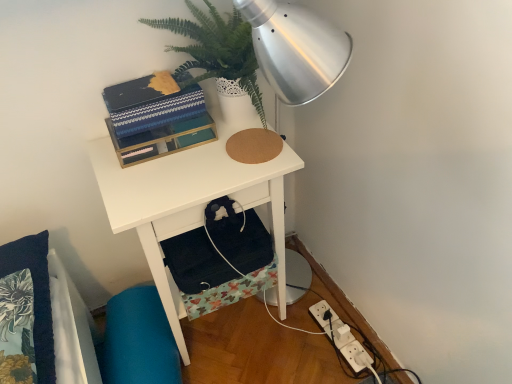
You are a GUI agent. You are given a task and a screenshot of the screen. Output one action in this format:
    pyautogui.click(x=<x>, y=<y>)
    Task: Click on the white matte desk at center
    
    Given the screenshot: What is the action you would take?
    pyautogui.click(x=189, y=201)

What do you see at coordinates (189, 201) in the screenshot? I see `white matte desk at center` at bounding box center [189, 201].

This screenshot has height=384, width=512. What do you see at coordinates (342, 337) in the screenshot?
I see `white plastic power outlet at lower right` at bounding box center [342, 337].

This screenshot has width=512, height=384. Find the location of `white plastic power outlet at lower right`. white plastic power outlet at lower right is located at coordinates (342, 337).

You are a GUI agent. You are given a task and a screenshot of the screen. Output one action in this format:
    pyautogui.click(x=<x>, y=<y>)
    Task: Click on the matte black book at upper center
    
    Given the screenshot: What is the action you would take?
    pyautogui.click(x=150, y=104)

In order to face green leafy plant at upper center, should I rotate leftwards or rightwards?

Turn left approximately 3.820 degrees to face it.

Locate an element on the screen. white matte desk at center is located at coordinates (189, 201).

From a real-world perspective, is matte black book at upper center physically located above or below teal fabric swivel chair at lower left?

From a real-world perspective, matte black book at upper center is physically above teal fabric swivel chair at lower left.

Considering the relative sizes of matte black book at upper center and teal fabric swivel chair at lower left in the image provided, is matte black book at upper center wider than teal fabric swivel chair at lower left?

No.

Considering the sizes of objects matte black book at upper center and teal fabric swivel chair at lower left in the image provided, who is bigger, matte black book at upper center or teal fabric swivel chair at lower left?

With larger size is teal fabric swivel chair at lower left.

Is matte black book at upper center shorter than teal fabric swivel chair at lower left?

Correct, matte black book at upper center is not as tall as teal fabric swivel chair at lower left.

Identify the location of paperback book above the white matte desk at center (from a real-world perspective). The image size is (512, 384). (150, 104).

Which point is more forward, (137, 189) or (143, 96)?

The point (137, 189) is in front.

From the image's perspective, which one is positioned lower, white matte desk at center or matte black book at upper center?

white matte desk at center, from the image's perspective.

Considering the positions of objects white matte desk at center and matte black book at upper center in the image provided, who is more to the right, white matte desk at center or matte black book at upper center?

From the viewer's perspective, white matte desk at center appears more on the right side.

Is point (277, 161) closer or farther from the camera than point (185, 47)?

Point (277, 161) is positioned closer to the camera compared to point (185, 47).

In terms of size, does white matte desk at center appear bigger or smaller than green leafy plant at upper center?

white matte desk at center is bigger than green leafy plant at upper center.

Is white matte desk at center thinner than green leafy plant at upper center?

In fact, white matte desk at center might be wider than green leafy plant at upper center.

Consider the image. Which object is closer to the camera, white matte desk at center or green leafy plant at upper center?

green leafy plant at upper center is more forward.

Can you tell me how much matte black book at upper center and white plastic power outlet at lower right differ in facing direction?

matte black book at upper center and white plastic power outlet at lower right are facing 5.46 degrees away from each other.

How far apart are matte black book at upper center and white plastic power outlet at lower right?

The distance of matte black book at upper center from white plastic power outlet at lower right is 35.13 inches.

Is matte black book at upper center facing towards white plastic power outlet at lower right?

No, matte black book at upper center does not turn towards white plastic power outlet at lower right.

Which is correct: matte black book at upper center is inside white plastic power outlet at lower right, or outside of it?

matte black book at upper center exists outside the volume of white plastic power outlet at lower right.

Considering the relative sizes of white plastic power outlet at lower right and teal fabric swivel chair at lower left in the image provided, is white plastic power outlet at lower right shorter than teal fabric swivel chair at lower left?

Yes.

From a real-world perspective, is white plastic power outlet at lower right beneath teal fabric swivel chair at lower left?

Correct, in the physical world, white plastic power outlet at lower right is lower than teal fabric swivel chair at lower left.

From a real-world perspective, who is located lower, teal fabric swivel chair at lower left or white plastic power outlet at lower right?

white plastic power outlet at lower right.

How different are the orientations of teal fabric swivel chair at lower left and white plastic power outlet at lower right in degrees?

There is a 78-degree angle between the facing directions of teal fabric swivel chair at lower left and white plastic power outlet at lower right.

From their relative heights in the image, would you say teal fabric swivel chair at lower left is taller or shorter than white plastic power outlet at lower right?

teal fabric swivel chair at lower left is taller than white plastic power outlet at lower right.

Considering the positions of objects white matte desk at center and white plastic power outlet at lower right in the image provided, who is more to the right, white matte desk at center or white plastic power outlet at lower right?

Positioned to the right is white plastic power outlet at lower right.

Is white matte desk at center bigger or smaller than white plastic power outlet at lower right?

Clearly, white matte desk at center is larger in size than white plastic power outlet at lower right.

From a real-world perspective, is white matte desk at center under white plastic power outlet at lower right?

No, from a real-world perspective, white matte desk at center is not beneath white plastic power outlet at lower right.

Where is `power outlet that appears below the white matte desk at center (from the image's perspective)`? power outlet that appears below the white matte desk at center (from the image's perspective) is located at coordinates (342, 337).

Locate an element on the screen. The width and height of the screenshot is (512, 384). paperback book located above the teal fabric swivel chair at lower left (from a real-world perspective) is located at coordinates (150, 104).

Find the location of a particular element. The image size is (512, 384). paperback book lying above the white matte desk at center (from the image's perspective) is located at coordinates (150, 104).

Which object lies further to the anchor point teal fabric swivel chair at lower left, white plastic power outlet at lower right or matte black book at upper center?

matte black book at upper center is further to teal fabric swivel chair at lower left.

Considering their positions, is green leafy plant at upper center positioned further to teal fabric swivel chair at lower left than matte black book at upper center?

Based on the image, green leafy plant at upper center appears to be further to teal fabric swivel chair at lower left.

Based on the photo, looking at the image, which one is located closer to white plastic power outlet at lower right, teal fabric swivel chair at lower left or matte black book at upper center?

teal fabric swivel chair at lower left is positioned closer to the anchor white plastic power outlet at lower right.

From the image, which object appears to be nearer to matte black book at upper center, white plastic power outlet at lower right or white matte desk at center?

Among the two, white matte desk at center is located nearer to matte black book at upper center.

Which object lies further to the anchor point green leafy plant at upper center, teal fabric swivel chair at lower left or white matte desk at center?

teal fabric swivel chair at lower left.

Based on their spatial positions, is matte black book at upper center or teal fabric swivel chair at lower left closer to green leafy plant at upper center?

matte black book at upper center is closer to green leafy plant at upper center.

When comparing their distances from white plastic power outlet at lower right, does green leafy plant at upper center or teal fabric swivel chair at lower left seem further?

green leafy plant at upper center is positioned further to the anchor white plastic power outlet at lower right.

Based on the photo, which object lies further to the anchor point matte black book at upper center, teal fabric swivel chair at lower left or white matte desk at center?

teal fabric swivel chair at lower left.

Where is `desk between teal fabric swivel chair at lower left and white plastic power outlet at lower right in the horizontal direction`? The height and width of the screenshot is (384, 512). desk between teal fabric swivel chair at lower left and white plastic power outlet at lower right in the horizontal direction is located at coordinates (189, 201).

In order to click on power outlet between matte black book at upper center and teal fabric swivel chair at lower left vertically in this screenshot , I will do `click(342, 337)`.

The width and height of the screenshot is (512, 384). I want to click on desk between green leafy plant at upper center and teal fabric swivel chair at lower left vertically, so click(189, 201).

Locate an element on the screen. This screenshot has height=384, width=512. desk between green leafy plant at upper center and white plastic power outlet at lower right in the vertical direction is located at coordinates (189, 201).